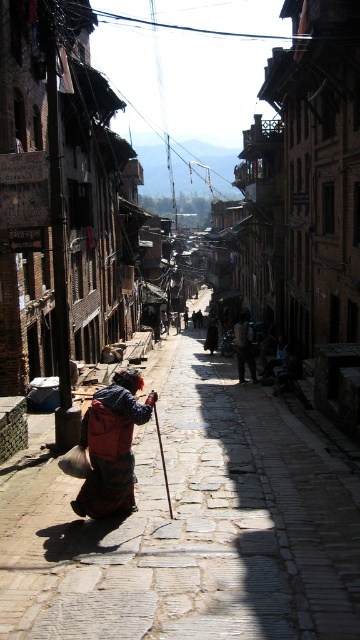
You are standing at the starting point of the cobblestone street and want to walk to the end of the street. There are two points marked on the path you need to pass through. The first point is at point (87, 422) and the second point is at point (245, 321). Which point will you encounter first while walking towards the end of the street?

You will encounter point (87, 422) first because it is closer to the camera, meaning it is nearer to your starting position at the beginning of the street.

You are a tourist carrying a red fabric backpack at lower left and a dark brown leather jacket at center. You want to place both items on a bench located in the shaded area. However, the bench is only 1 meter wide. Can both items fit on the bench without overlapping?

The red fabric backpack at lower left is positioned under dark brown leather jacket at center, which means they are stacked vertically. Since the bench is 1 meter wide, the total width of both items must be less than or equal to 1 meter. However, their exact widths are not provided, so it is impossible to determine if they will fit without additional information.